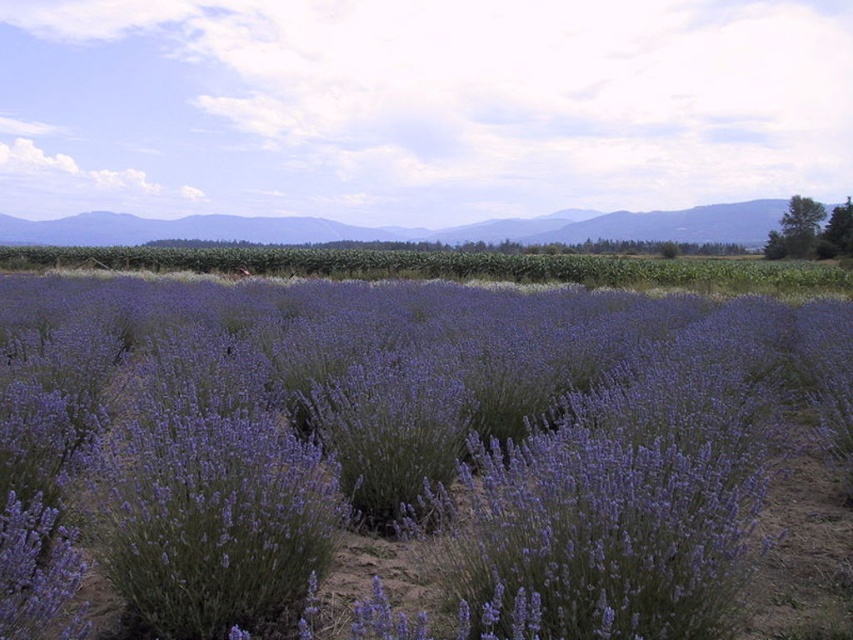
Question: Can you confirm if purple soft lavender at center is wider than smooth green mountains at upper center?

Choices:
 (A) yes
 (B) no

Answer: (B)

Question: Among these objects, which one is farthest from the camera?

Choices:
 (A) purple soft lavender at center
 (B) smooth green mountains at upper center

Answer: (B)

Question: Does purple soft lavender at center appear on the right side of smooth green mountains at upper center?

Choices:
 (A) no
 (B) yes

Answer: (B)

Question: Can you confirm if purple soft lavender at center is smaller than smooth green mountains at upper center?

Choices:
 (A) no
 (B) yes

Answer: (B)

Question: Which point appears farthest from the camera in this image?

Choices:
 (A) (676, 211)
 (B) (111, 512)

Answer: (A)